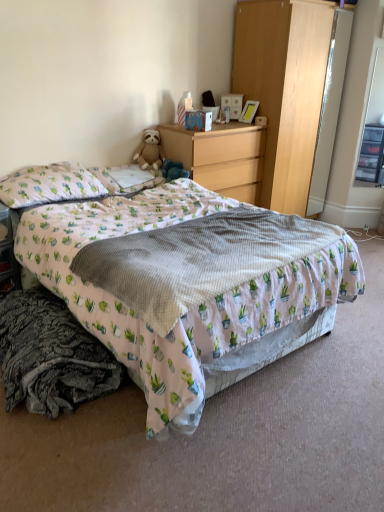
Question: Could you tell me if transparent plastic drawers at right is turned towards white fabric pillow at upper left, which is counted as the 2th pillow, starting from the left?

Choices:
 (A) no
 (B) yes

Answer: (A)

Question: Considering the relative sizes of transparent plastic drawers at right and white fabric pillow at upper left, which is counted as the 2th pillow, starting from the left, in the image provided, is transparent plastic drawers at right shorter than white fabric pillow at upper left, which is counted as the 2th pillow, starting from the left,?

Choices:
 (A) yes
 (B) no

Answer: (B)

Question: Can you confirm if transparent plastic drawers at right is smaller than white fabric pillow at upper left, the 1th pillow positioned from the right?

Choices:
 (A) yes
 (B) no

Answer: (B)

Question: Is transparent plastic drawers at right positioned in front of white fabric pillow at upper left, which is counted as the 2th pillow, starting from the left?

Choices:
 (A) no
 (B) yes

Answer: (A)

Question: Is transparent plastic drawers at right positioned with its back to white fabric pillow at upper left, the 1th pillow positioned from the right?

Choices:
 (A) yes
 (B) no

Answer: (B)

Question: From a real-world perspective, is transparent plastic drawers at right over white fabric pillow at upper left, which is counted as the 2th pillow, starting from the left?

Choices:
 (A) no
 (B) yes

Answer: (B)

Question: Is printed fabric bed at center positioned behind wooden chest of drawers at center?

Choices:
 (A) no
 (B) yes

Answer: (A)

Question: Is printed fabric bed at center located outside wooden chest of drawers at center?

Choices:
 (A) no
 (B) yes

Answer: (B)

Question: Does printed fabric bed at center have a lesser width compared to wooden chest of drawers at center?

Choices:
 (A) yes
 (B) no

Answer: (B)

Question: Considering the relative positions of printed fabric bed at center and wooden chest of drawers at center in the image provided, is printed fabric bed at center to the right of wooden chest of drawers at center from the viewer's perspective?

Choices:
 (A) yes
 (B) no

Answer: (B)

Question: Is printed fabric bed at center shorter than wooden chest of drawers at center?

Choices:
 (A) yes
 (B) no

Answer: (A)

Question: Does printed fabric bed at center have a larger size compared to wooden chest of drawers at center?

Choices:
 (A) no
 (B) yes

Answer: (B)

Question: Is soft brown teddy bear at center closer to the viewer compared to wooden chest of drawers at center?

Choices:
 (A) no
 (B) yes

Answer: (A)